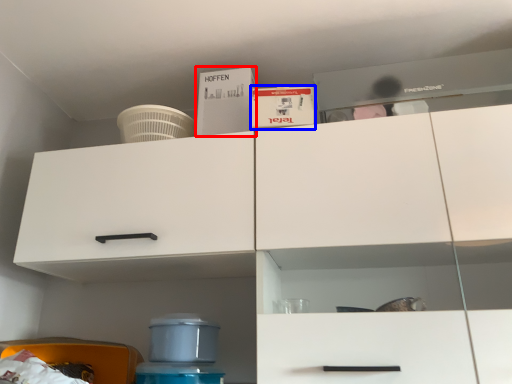
Question: Which object is further to the camera taking this photo, box (highlighted by a red box) or box (highlighted by a blue box)?

Choices:
 (A) box
 (B) box

Answer: (A)